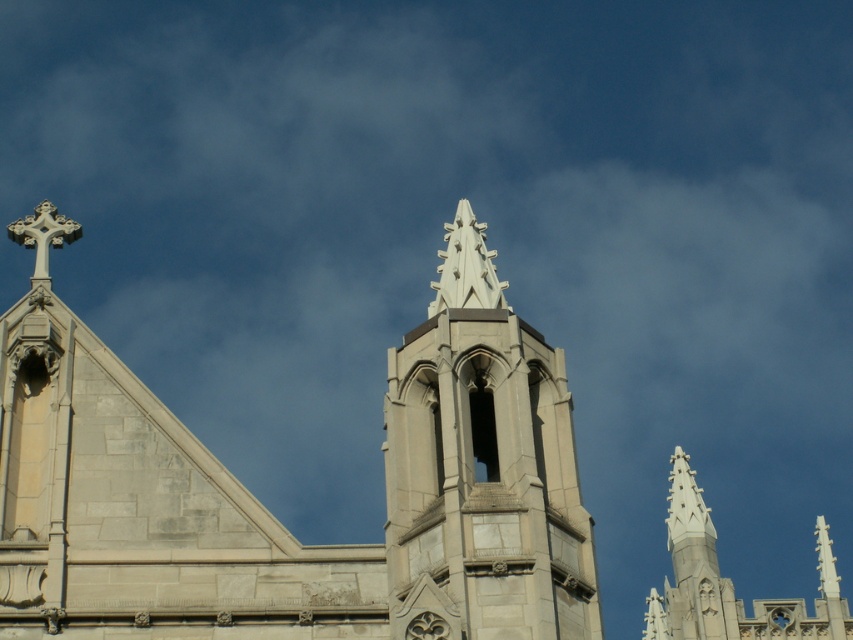
Looking at this image, does gray stone church steeple at center have a greater height compared to white stone tower at center?

A: Indeed, gray stone church steeple at center has a greater height compared to white stone tower at center.

Is point (701, 582) closer to viewer compared to point (474, 600)?

No, it is behind (474, 600).

You are a GUI agent. You are given a task and a screenshot of the screen. Output one action in this format:
    pyautogui.click(x=<x>, y=<y>)
    Task: Click on the gray stone church steeple at center
    
    Given the screenshot: What is the action you would take?
    pyautogui.click(x=270, y=513)